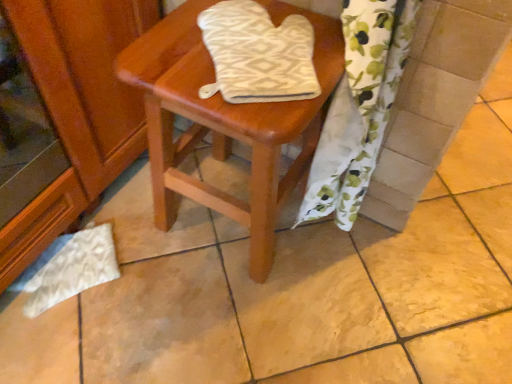
The height and width of the screenshot is (384, 512). What are the coordinates of `free space underneath wooden stool at center (from a real-world perspective)` in the screenshot? It's located at (x=217, y=218).